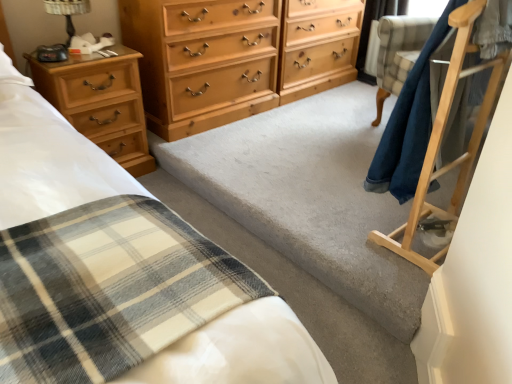
Where is `light brown wood chest of drawers at center, marked as the 1th chest of drawers in a right-to-left arrangement`? The width and height of the screenshot is (512, 384). light brown wood chest of drawers at center, marked as the 1th chest of drawers in a right-to-left arrangement is located at coordinates (236, 56).

At what (x,y) coordinates should I click in order to perform the action: click on metallic black table lamp at upper left. Please return your answer as a coordinate pair (x, y). Image resolution: width=512 pixels, height=384 pixels. Looking at the image, I should click on (67, 12).

What are the coordinates of `light brown wood dresser at center` in the screenshot? It's located at (318, 46).

Is point (86, 125) in front of point (72, 0)?

Yes, point (86, 125) is closer to viewer.

Consider the image. Who is shorter, light brown wood chest of drawers at left, which is the 1th chest of drawers from left to right, or metallic black table lamp at upper left?

metallic black table lamp at upper left is shorter.

I want to click on table lamp above the light brown wood chest of drawers at left, positioned as the second chest of drawers in right-to-left order (from the image's perspective), so pos(67,12).

In terms of height, does light brown wood dresser at center look taller or shorter compared to metallic black table lamp at upper left?

Considering their sizes, light brown wood dresser at center has more height than metallic black table lamp at upper left.

Does point (322, 67) appear closer or farther from the camera than point (72, 29)?

Point (322, 67) is farther from the camera than point (72, 29).

Is light brown wood dresser at center to the right of metallic black table lamp at upper left from the viewer's perspective?

Correct, you'll find light brown wood dresser at center to the right of metallic black table lamp at upper left.

Does light brown wood dresser at center have a greater width compared to metallic black table lamp at upper left?

Yes.

Is light brown wood dresser at center positioned far away from light brown wood chest of drawers at left, positioned as the second chest of drawers in right-to-left order?

Yes, light brown wood dresser at center and light brown wood chest of drawers at left, positioned as the second chest of drawers in right-to-left order, are located far from each other.

How different are the orientations of light brown wood dresser at center and light brown wood chest of drawers at left, which is the 1th chest of drawers from left to right, in degrees?

0.275 degrees separate the facing orientations of light brown wood dresser at center and light brown wood chest of drawers at left, which is the 1th chest of drawers from left to right.

Could you measure the distance between light brown wood dresser at center and light brown wood chest of drawers at left, which is the 1th chest of drawers from left to right?

light brown wood dresser at center is 1.32 meters away from light brown wood chest of drawers at left, which is the 1th chest of drawers from left to right.

From their relative heights in the image, would you say light brown wood dresser at center is taller or shorter than light brown wood chest of drawers at left, positioned as the second chest of drawers in right-to-left order?

Clearly, light brown wood dresser at center is taller compared to light brown wood chest of drawers at left, positioned as the second chest of drawers in right-to-left order.

Is light brown wood chest of drawers at center, marked as the 1th chest of drawers in a right-to-left arrangement, directly adjacent to metallic black table lamp at upper left?

They are not placed beside each other.

Which object is positioned more to the right, light brown wood chest of drawers at center, marked as the 1th chest of drawers in a right-to-left arrangement, or metallic black table lamp at upper left?

Positioned to the right is light brown wood chest of drawers at center, marked as the 1th chest of drawers in a right-to-left arrangement.

Considering the relative sizes of light brown wood chest of drawers at center, the second chest of drawers viewed from the left, and metallic black table lamp at upper left in the image provided, is light brown wood chest of drawers at center, the second chest of drawers viewed from the left, wider than metallic black table lamp at upper left?

Yes, light brown wood chest of drawers at center, the second chest of drawers viewed from the left, is wider than metallic black table lamp at upper left.

From the image's perspective, is light brown wood chest of drawers at center, the second chest of drawers viewed from the left, located beneath metallic black table lamp at upper left?

Actually, light brown wood chest of drawers at center, the second chest of drawers viewed from the left, appears above metallic black table lamp at upper left in the image.

Is point (284, 53) positioned before point (87, 127)?

No.

From the image's perspective, which is below, light brown wood chest of drawers at center, the second chest of drawers viewed from the left, or light brown wood chest of drawers at left, positioned as the second chest of drawers in right-to-left order?

light brown wood chest of drawers at left, positioned as the second chest of drawers in right-to-left order, is shown below in the image.

Between light brown wood chest of drawers at center, marked as the 1th chest of drawers in a right-to-left arrangement, and light brown wood chest of drawers at left, which is the 1th chest of drawers from left to right, which one has larger width?

light brown wood chest of drawers at center, marked as the 1th chest of drawers in a right-to-left arrangement, is wider.

Does light brown wood chest of drawers at left, which is the 1th chest of drawers from left to right, have a larger size compared to light brown wood chest of drawers at center, marked as the 1th chest of drawers in a right-to-left arrangement?

Incorrect, light brown wood chest of drawers at left, which is the 1th chest of drawers from left to right, is not larger than light brown wood chest of drawers at center, marked as the 1th chest of drawers in a right-to-left arrangement.

From the image's perspective, is light brown wood chest of drawers at left, which is the 1th chest of drawers from left to right, on top of light brown wood chest of drawers at center, the second chest of drawers viewed from the left?

No.

Which of these two, light brown wood chest of drawers at left, which is the 1th chest of drawers from left to right, or light brown wood chest of drawers at center, the second chest of drawers viewed from the left, is wider?

light brown wood chest of drawers at center, the second chest of drawers viewed from the left, is wider.

How distant is light brown wood chest of drawers at left, which is the 1th chest of drawers from left to right, from light brown wood chest of drawers at center, marked as the 1th chest of drawers in a right-to-left arrangement?

light brown wood chest of drawers at left, which is the 1th chest of drawers from left to right, is 50.47 centimeters from light brown wood chest of drawers at center, marked as the 1th chest of drawers in a right-to-left arrangement.

Considering the positions of objects light brown wood chest of drawers at center, marked as the 1th chest of drawers in a right-to-left arrangement, and light brown wood dresser at center in the image provided, who is more to the left, light brown wood chest of drawers at center, marked as the 1th chest of drawers in a right-to-left arrangement, or light brown wood dresser at center?

light brown wood chest of drawers at center, marked as the 1th chest of drawers in a right-to-left arrangement.

How different are the orientations of light brown wood chest of drawers at center, marked as the 1th chest of drawers in a right-to-left arrangement, and light brown wood dresser at center in degrees?

light brown wood chest of drawers at center, marked as the 1th chest of drawers in a right-to-left arrangement, and light brown wood dresser at center are facing 1.11 degrees away from each other.

From the image's perspective, which object appears higher, light brown wood chest of drawers at center, marked as the 1th chest of drawers in a right-to-left arrangement, or light brown wood dresser at center?

From the image's view, light brown wood dresser at center is above.

Are light brown wood chest of drawers at center, marked as the 1th chest of drawers in a right-to-left arrangement, and light brown wood dresser at center far apart?

No.

Locate an element on the screen. table lamp located behind the light brown wood chest of drawers at left, positioned as the second chest of drawers in right-to-left order is located at coordinates (67, 12).

Where is `file cabinet on the right of metallic black table lamp at upper left`? The height and width of the screenshot is (384, 512). file cabinet on the right of metallic black table lamp at upper left is located at coordinates (318, 46).

Considering their positions, is light brown wood chest of drawers at center, marked as the 1th chest of drawers in a right-to-left arrangement, positioned further to light brown wood chest of drawers at left, positioned as the second chest of drawers in right-to-left order, than metallic black table lamp at upper left?

metallic black table lamp at upper left lies further to light brown wood chest of drawers at left, positioned as the second chest of drawers in right-to-left order, than the other object.

From the image, which object appears to be nearer to metallic black table lamp at upper left, light brown wood dresser at center or light brown wood chest of drawers at left, which is the 1th chest of drawers from left to right?

light brown wood chest of drawers at left, which is the 1th chest of drawers from left to right.

In the scene shown: Looking at the image, which one is located further to light brown wood dresser at center, light brown wood chest of drawers at center, the second chest of drawers viewed from the left, or light brown wood chest of drawers at left, which is the 1th chest of drawers from left to right?

light brown wood chest of drawers at left, which is the 1th chest of drawers from left to right, is further to light brown wood dresser at center.

Considering their positions, is light brown wood chest of drawers at center, marked as the 1th chest of drawers in a right-to-left arrangement, positioned closer to light brown wood dresser at center than metallic black table lamp at upper left?

light brown wood chest of drawers at center, marked as the 1th chest of drawers in a right-to-left arrangement, is closer to light brown wood dresser at center.

Estimate the real-world distances between objects in this image. Which object is closer to light brown wood chest of drawers at center, the second chest of drawers viewed from the left, light brown wood chest of drawers at left, positioned as the second chest of drawers in right-to-left order, or metallic black table lamp at upper left?

Among the two, light brown wood chest of drawers at left, positioned as the second chest of drawers in right-to-left order, is located nearer to light brown wood chest of drawers at center, the second chest of drawers viewed from the left.

Estimate the real-world distances between objects in this image. Which object is further from light brown wood chest of drawers at left, positioned as the second chest of drawers in right-to-left order, metallic black table lamp at upper left or light brown wood chest of drawers at center, marked as the 1th chest of drawers in a right-to-left arrangement?

The object further to light brown wood chest of drawers at left, positioned as the second chest of drawers in right-to-left order, is metallic black table lamp at upper left.

Considering their positions, is metallic black table lamp at upper left positioned further to light brown wood chest of drawers at left, which is the 1th chest of drawers from left to right, than light brown wood dresser at center?

light brown wood dresser at center is positioned further to the anchor light brown wood chest of drawers at left, which is the 1th chest of drawers from left to right.

Based on their spatial positions, is metallic black table lamp at upper left or light brown wood chest of drawers at left, positioned as the second chest of drawers in right-to-left order, further from light brown wood chest of drawers at center, the second chest of drawers viewed from the left?

metallic black table lamp at upper left lies further to light brown wood chest of drawers at center, the second chest of drawers viewed from the left, than the other object.

The height and width of the screenshot is (384, 512). I want to click on chest of drawers between light brown wood chest of drawers at left, positioned as the second chest of drawers in right-to-left order, and light brown wood dresser at center, so click(236, 56).

Find the location of `the chest of drawers situated between metallic black table lamp at upper left and light brown wood chest of drawers at center, marked as the 1th chest of drawers in a right-to-left arrangement, from left to right`. the chest of drawers situated between metallic black table lamp at upper left and light brown wood chest of drawers at center, marked as the 1th chest of drawers in a right-to-left arrangement, from left to right is located at coordinates [x=100, y=102].